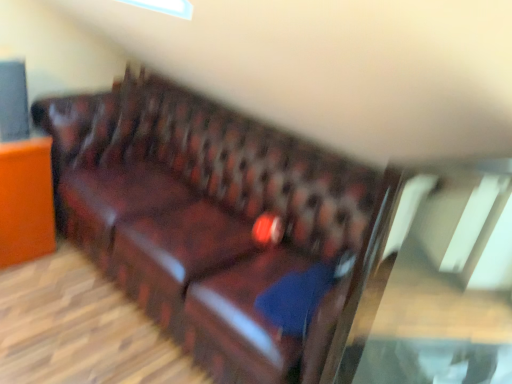
Question: From the image's perspective, is matte brown leather sofa at left above or below leather couch at center?

Choices:
 (A) below
 (B) above

Answer: (B)

Question: Based on their sizes in the image, would you say matte brown leather sofa at left is bigger or smaller than leather couch at center?

Choices:
 (A) big
 (B) small

Answer: (B)

Question: Based on their relative distances, which object is farther from the transparent glass table at center?

Choices:
 (A) blue fabric pillow at center
 (B) matte brown leather sofa at left
 (C) leather couch at center

Answer: (B)

Question: Which object is the farthest from the blue fabric pillow at center?

Choices:
 (A) matte brown leather sofa at left
 (B) leather couch at center
 (C) transparent glass table at center

Answer: (A)